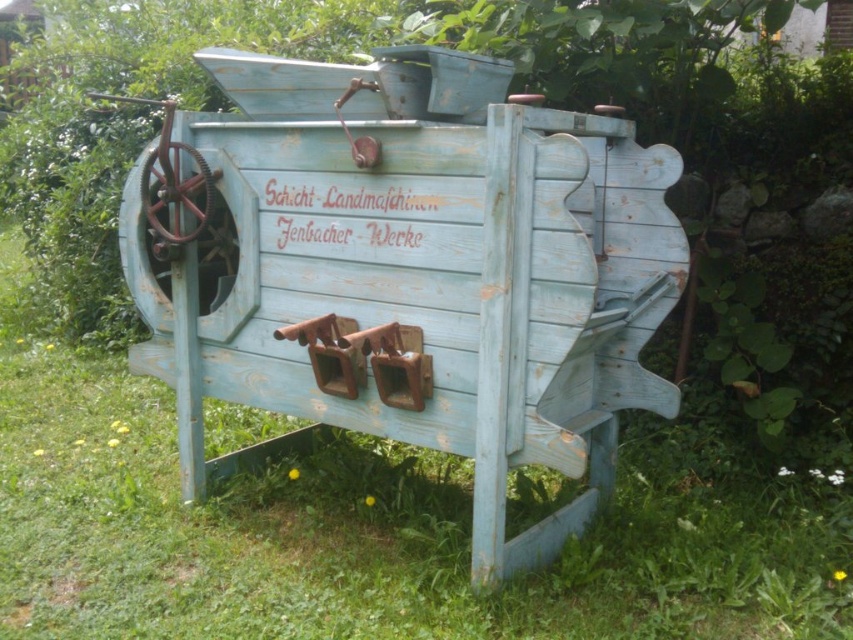
You are a farmer assessing the space needed to store the distressed blue wood wagon at center and the green grass at lower center. Which object requires more space in terms of area?

The green grass at lower center requires more space because it is larger than the distressed blue wood wagon at center.

Based on the scene description, what does the point at coordinates (413, 269) represent?

The point at coordinates (413, 269) represents the distressed blue wood wagon at center.

You are standing in front of the old agricultural machine and want to touch both points labeled as point (310,115) and point (152,588). Which point will you reach first?

You will reach point (310,115) first because it is closer to you than point (152,588), which is further away.